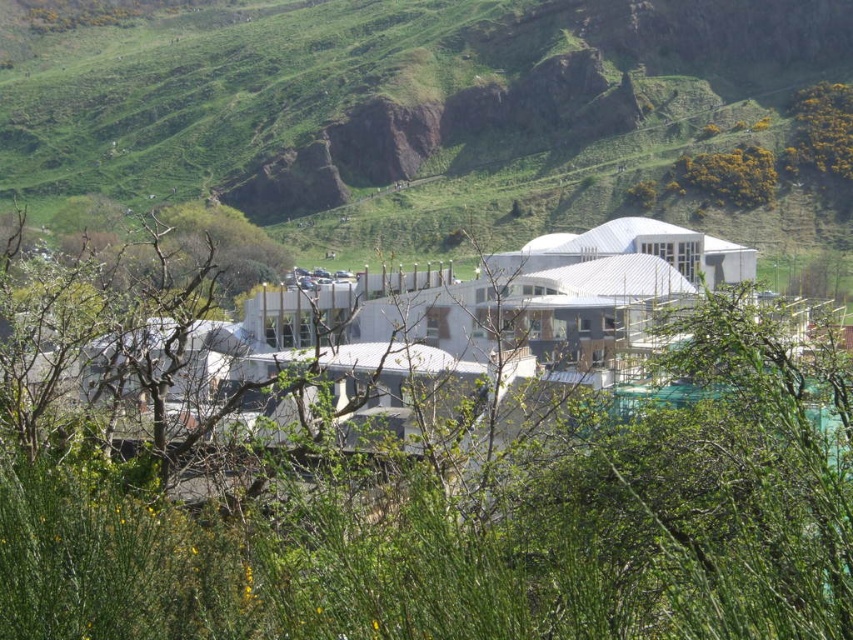
Question: Does green leafy shrubs at center have a larger size compared to green grassy hillside at center?

Choices:
 (A) no
 (B) yes

Answer: (A)

Question: Among these objects, which one is farthest from the camera?

Choices:
 (A) green leafy shrubs at center
 (B) green grassy hillside at center

Answer: (B)

Question: Which point is farther from the camera taking this photo?

Choices:
 (A) pos(663,100)
 (B) pos(610,460)

Answer: (A)

Question: Is green leafy shrubs at center thinner than green grassy hillside at center?

Choices:
 (A) no
 (B) yes

Answer: (B)

Question: Is green leafy shrubs at center below green grassy hillside at center?

Choices:
 (A) yes
 (B) no

Answer: (A)